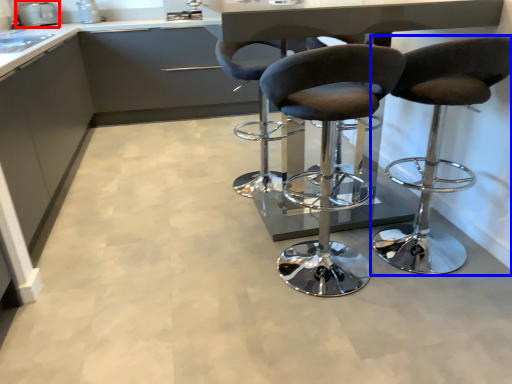
Question: Which object is closer to the camera taking this photo, appliance (highlighted by a red box) or chair (highlighted by a blue box)?

Choices:
 (A) appliance
 (B) chair

Answer: (B)